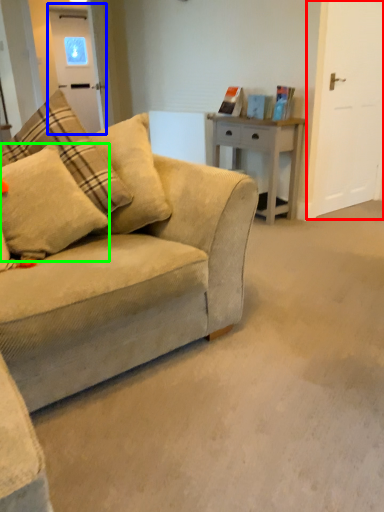
Question: Based on their relative distances, which object is nearer to glass door (highlighted by a red box)? Choose from glass door (highlighted by a blue box) and pillow (highlighted by a green box).

Choices:
 (A) glass door
 (B) pillow

Answer: (B)